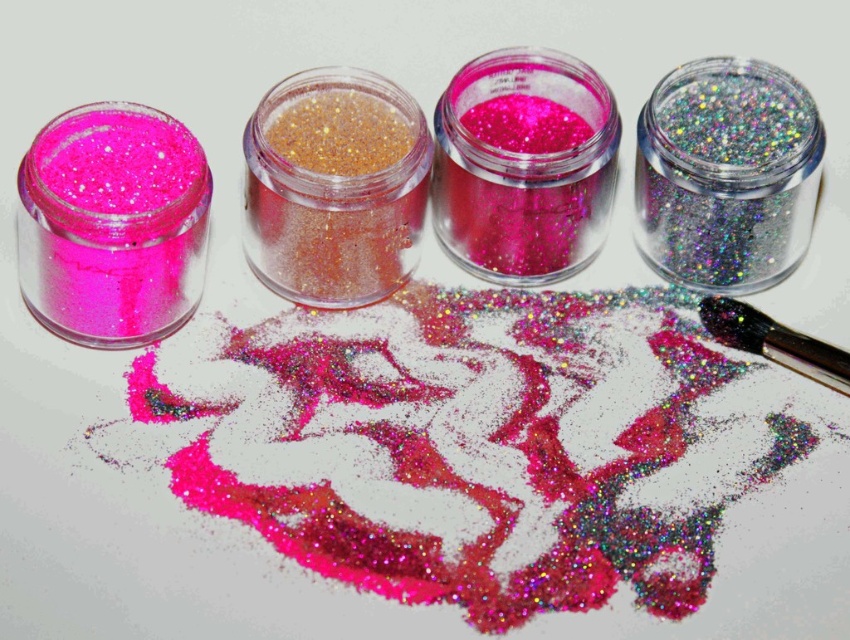
Which of these two, gold glitter powder at center or metallic silver brush at upper right, stands shorter?

metallic silver brush at upper right is shorter.

From the picture: Is gold glitter powder at center to the right of metallic silver brush at upper right from the viewer's perspective?

No, gold glitter powder at center is not to the right of metallic silver brush at upper right.

What do you see at coordinates (335, 186) in the screenshot? Image resolution: width=850 pixels, height=640 pixels. I see `gold glitter powder at center` at bounding box center [335, 186].

Find the location of a particular element. This screenshot has width=850, height=640. gold glitter powder at center is located at coordinates (335, 186).